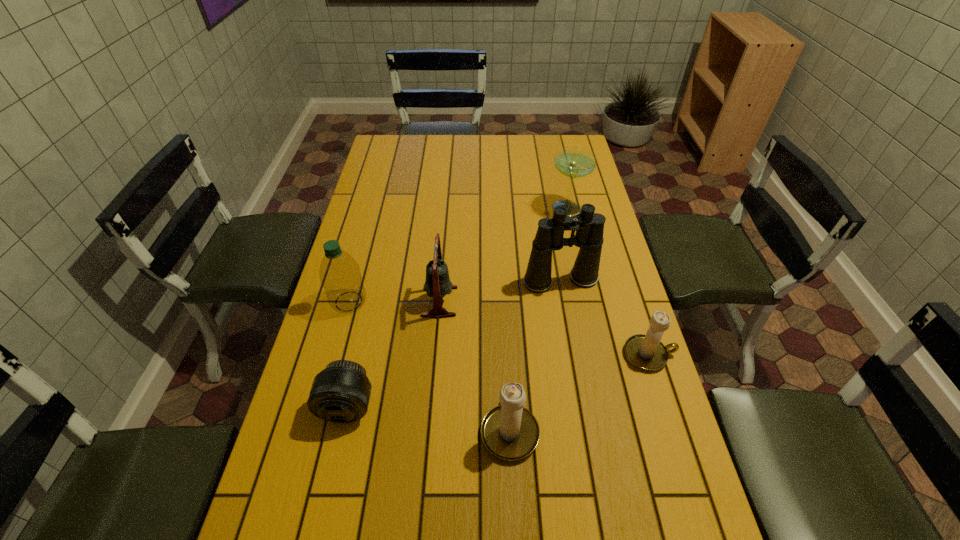
Please point a spot on the left to add another candle holder. Please provide its 2D coordinates. Your answer should be formatted as a tuple, i.e. [(x, y)], where the tuple contains the x and y coordinates of a point satisfying the conditions above.

[(325, 526)]